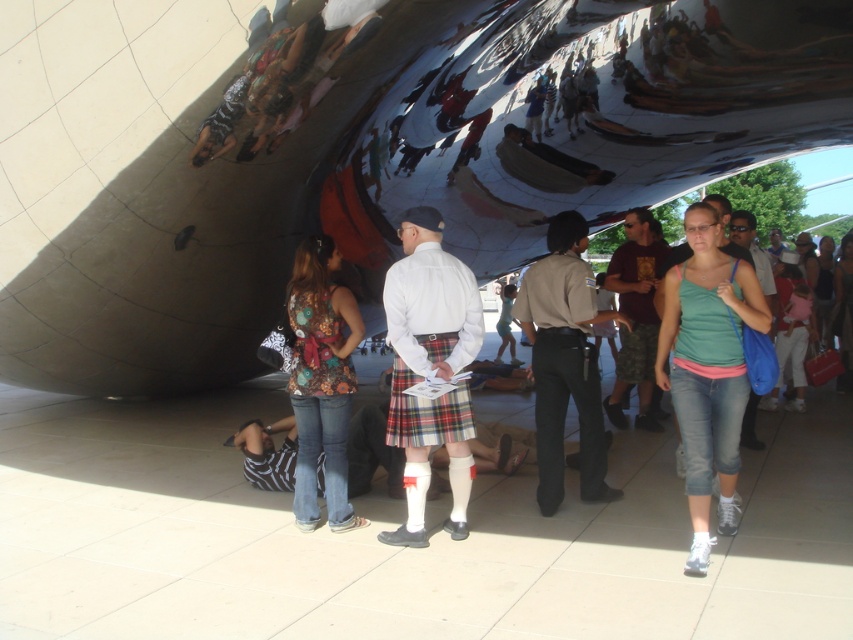
Question: Does floral-patterned fabric at lower left lie behind matte black shirt at center?

Choices:
 (A) no
 (B) yes

Answer: (A)

Question: Is green cotton tank top at center wider than matte green tank top at center?

Choices:
 (A) yes
 (B) no

Answer: (B)

Question: Which object is farther from the camera taking this photo?

Choices:
 (A) matte green tank top at center
 (B) green cotton tank top at center
 (C) floral-patterned fabric at lower left
 (D) matte black shirt at center

Answer: (D)

Question: Which of the following is the farthest from the observer?

Choices:
 (A) (346, 419)
 (B) (849, 266)
 (C) (694, 291)
 (D) (824, 310)

Answer: (B)

Question: Which of the following is the closest to the observer?

Choices:
 (A) (347, 525)
 (B) (824, 321)

Answer: (A)

Question: In this image, where is floral-patterned fabric at lower left located relative to matte green tank top at center?

Choices:
 (A) above
 (B) below

Answer: (B)